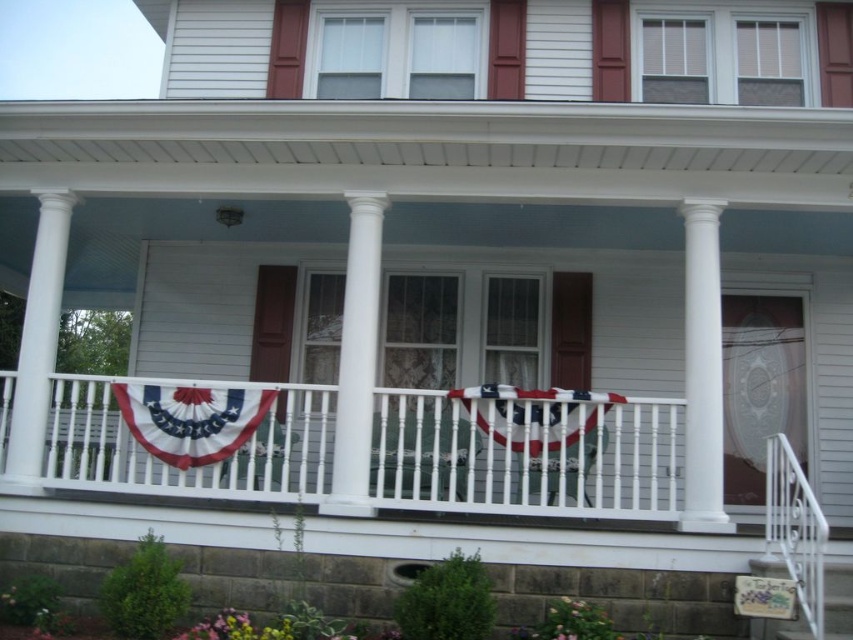
You are standing in front of the house and notice two points marked on the image. The first point is at coordinates point (x=204, y=420) and the second is at point (x=788, y=442). Which point is closer to you?

Point (x=204, y=420) is closer to the camera than point (x=788, y=442), so the first point is closer to you.

You are standing on the front porch of a white house with red accents. You notice a specific point marked at coordinates point (x=527, y=452). Based on the scene description, what is located at this point?

The point (x=527, y=452) marks the white painted wood porch at center.

You are standing in front of the house and want to locate the white painted wood porch at center. What are the coordinates where you should look to find it?

The white painted wood porch at center can be found at coordinates point (527, 452).